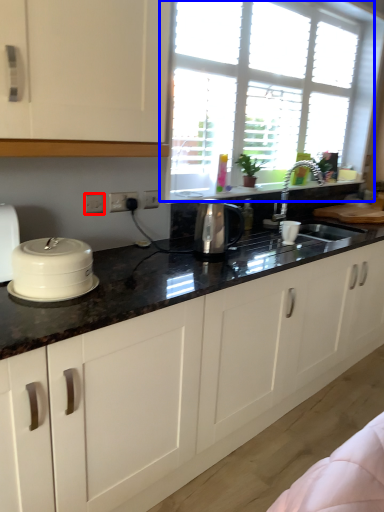
Question: Which of the following is the closest to the observer, electric outlet (highlighted by a red box) or window (highlighted by a blue box)?

Choices:
 (A) electric outlet
 (B) window

Answer: (A)